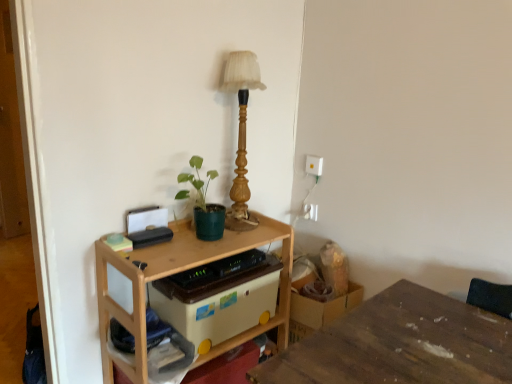
Find the location of a particular element. free space in front of green matte plant at center is located at coordinates (182, 259).